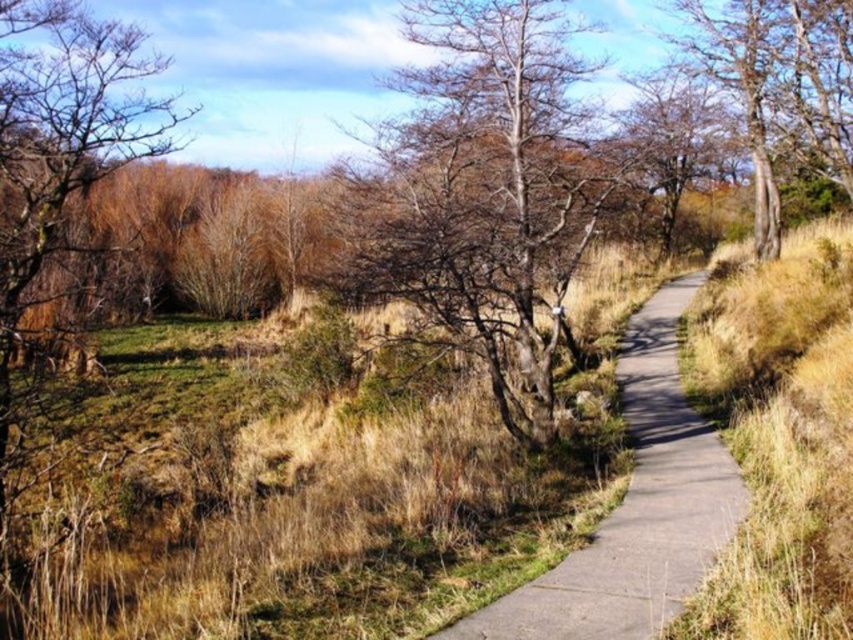
You are standing at the starting point of the pathway and want to reach a destination located at point (776, 116). There is another point at (668, 502) along the way. According to the scene description, which point should you pass first?

You should pass point (668, 502) first because it is in front of point (776, 116) along the pathway.

You are standing at the point marked by coordinates (480, 193) in the image. Looking around, you see the paved pathway and the surrounding grassy area. What do you observe immediately around your current position?

The point marked by coordinates (480, 193) indicates bare branches at center, so you are standing at the center of the scene where there are bare branches above you.

You are a hiker standing on the concrete at center. You want to take a photo of the bare wood tree at upper right. Which direction should you face to ensure the tree is in the frame?

The concrete at center is positioned under the bare wood tree at upper right, so facing upward or toward the upper right would ensure the tree is in the frame.